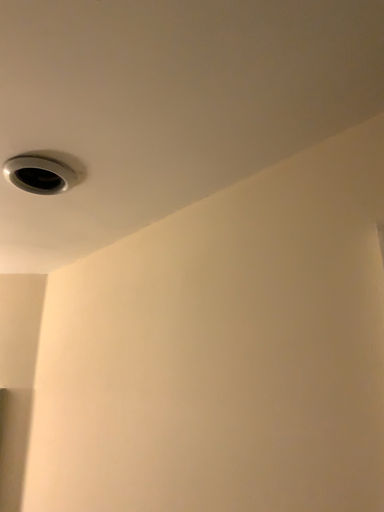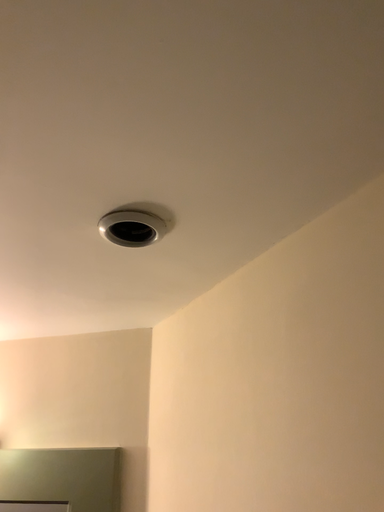
Question: How did the camera likely rotate when shooting the video?

Choices:
 (A) rotated left
 (B) rotated right

Answer: (A)